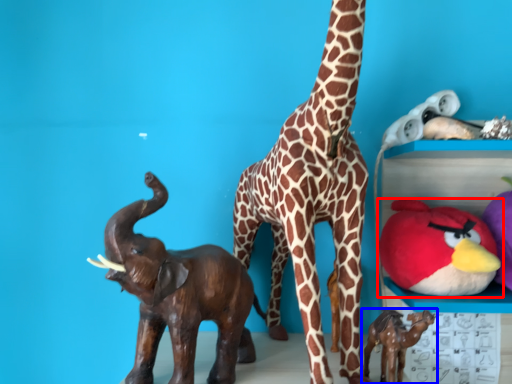
Question: Which of the following is the closest to the observer, toy (highlighted by a red box) or toy (highlighted by a blue box)?

Choices:
 (A) toy
 (B) toy

Answer: (B)